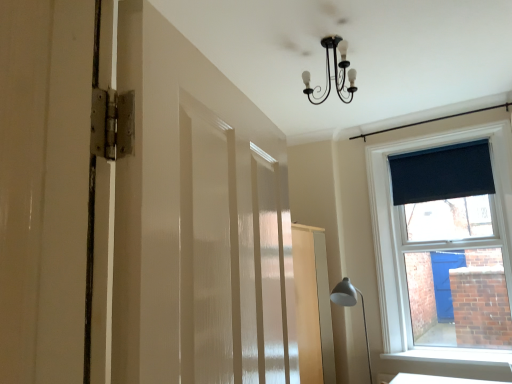
Question: Is dark blue fabric at upper right in front of or behind black wrought iron chandelier at upper center in the image?

Choices:
 (A) front
 (B) behind

Answer: (B)

Question: From the image's perspective, relative to black wrought iron chandelier at upper center, is dark blue fabric at upper right above or below?

Choices:
 (A) below
 (B) above

Answer: (A)

Question: Estimate the real-world distances between objects in this image. Which object is closer to the dark blue fabric at upper right?

Choices:
 (A) matte silver lamp at lower right
 (B) black wrought iron chandelier at upper center
 (C) white textured barn door at left
 (D) white glossy table at lower right
 (E) white smooth window sill at lower right

Answer: (A)

Question: Estimate the real-world distances between objects in this image. Which object is farther from the white smooth window sill at lower right?

Choices:
 (A) dark blue fabric at upper right
 (B) white glossy table at lower right
 (C) matte silver lamp at lower right
 (D) white textured barn door at left
 (E) black wrought iron chandelier at upper center

Answer: (D)